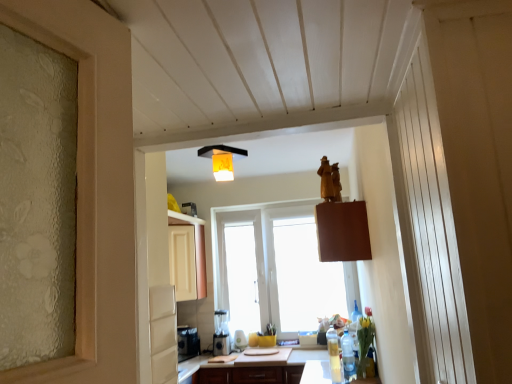
Question: Is white matte cabinet at upper left facing towards translucent plastic bottle at lower right, arranged as the second bottle when viewed from the front?

Choices:
 (A) yes
 (B) no

Answer: (A)

Question: From a real-world perspective, does white matte cabinet at upper left sit lower than translucent plastic bottle at lower right, arranged as the second bottle when viewed from the front?

Choices:
 (A) no
 (B) yes

Answer: (A)

Question: Does white matte cabinet at upper left have a lesser width compared to translucent plastic bottle at lower right, arranged as the second bottle when viewed from the front?

Choices:
 (A) no
 (B) yes

Answer: (A)

Question: Is white matte cabinet at upper left to the left of translucent plastic bottle at lower right, which is counted as the first bottle, starting from the back, from the viewer's perspective?

Choices:
 (A) yes
 (B) no

Answer: (A)

Question: Is translucent plastic bottle at lower right, arranged as the second bottle when viewed from the front, surrounded by white matte cabinet at upper left?

Choices:
 (A) no
 (B) yes

Answer: (A)

Question: Is black plastic coffee machine at lower center bigger or smaller than clear plastic bottle at lower right, which ranks as the second bottle in back-to-front order?

Choices:
 (A) big
 (B) small

Answer: (A)

Question: Do you think black plastic coffee machine at lower center is within clear plastic bottle at lower right, acting as the 1th bottle starting from the front, or outside of it?

Choices:
 (A) outside
 (B) inside

Answer: (A)

Question: In terms of height, does black plastic coffee machine at lower center look taller or shorter compared to clear plastic bottle at lower right, acting as the 1th bottle starting from the front?

Choices:
 (A) tall
 (B) short

Answer: (A)

Question: Is point 224,347 closer or farther from the camera than point 348,367?

Choices:
 (A) closer
 (B) farther

Answer: (B)

Question: In terms of height, does matte brown countertop at center look taller or shorter compared to white matte cabinet at upper left?

Choices:
 (A) tall
 (B) short

Answer: (B)

Question: From the image's perspective, relative to white matte cabinet at upper left, is matte brown countertop at center above or below?

Choices:
 (A) below
 (B) above

Answer: (A)

Question: In terms of size, does matte brown countertop at center appear bigger or smaller than white matte cabinet at upper left?

Choices:
 (A) small
 (B) big

Answer: (B)

Question: In the image, is matte brown countertop at center positioned in front of or behind white matte cabinet at upper left?

Choices:
 (A) behind
 (B) front

Answer: (B)

Question: From a real-world perspective, is wooden statue at upper center above or below white matte cabinet at upper left?

Choices:
 (A) below
 (B) above

Answer: (A)

Question: Choose the correct answer: Is wooden statue at upper center inside white matte cabinet at upper left or outside it?

Choices:
 (A) inside
 (B) outside

Answer: (B)